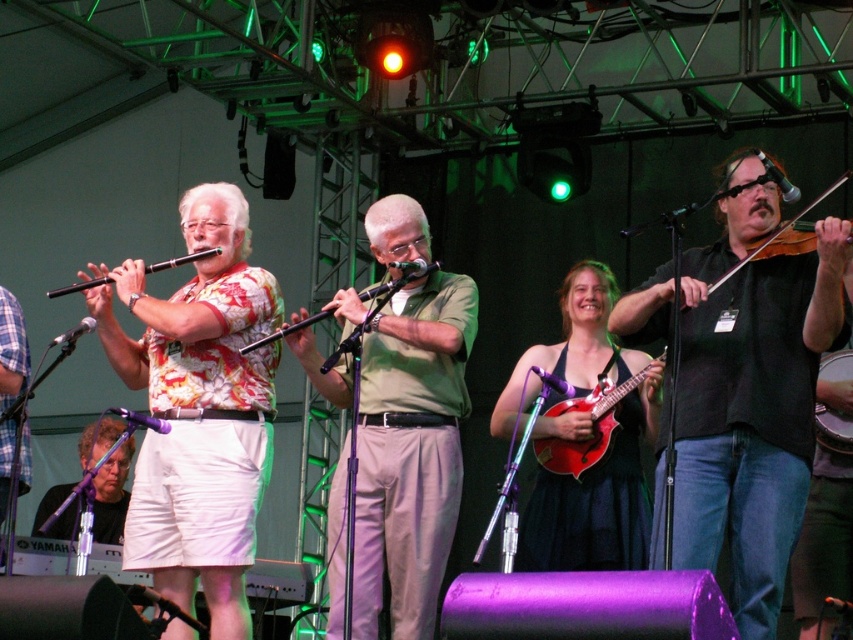
You are a photographer positioned at the back of the stage. You want to take a photo of the floral shirt at center and the matte black flute at left. Which object will appear closer to you in the photo?

The floral shirt at center will appear closer to you in the photo because it is further to the viewer than the matte black flute at left.

You are a photographer taking a photo of the stage. The stage has a matte red mandolin at center. Where should you focus your camera to capture the mandolin clearly?

You should focus your camera at point (590,428) to capture the matte red mandolin at center clearly.

You are a photographer standing at the center of the stage. You need to position a spotlight at point (596, 500). Which object should you aim the spotlight at?

The matte purple dress at center is located at point (596, 500), so you should aim the spotlight at the matte purple dress at center.